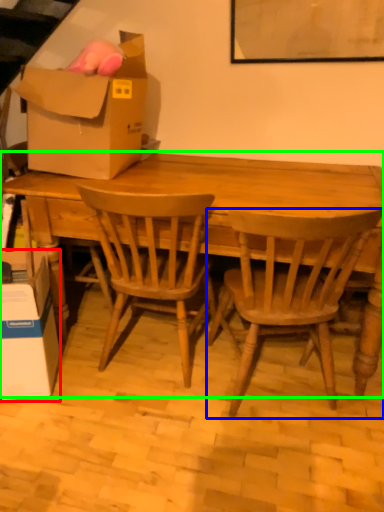
Question: Estimate the real-world distances between objects in this image. Which object is closer to box (highlighted by a red box), chair (highlighted by a blue box) or desk (highlighted by a green box)?

Choices:
 (A) chair
 (B) desk

Answer: (B)